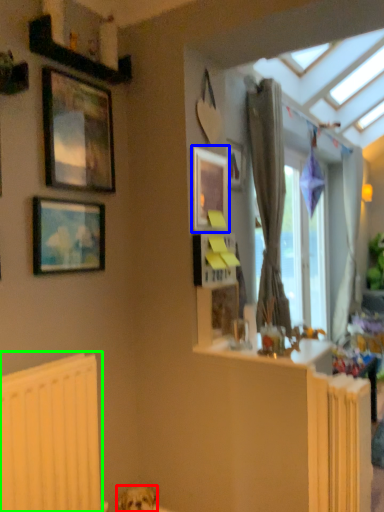
Question: Which is nearer to the dog (highlighted by a red box)? picture frame (highlighted by a blue box) or radiator (highlighted by a green box).

Choices:
 (A) picture frame
 (B) radiator

Answer: (B)